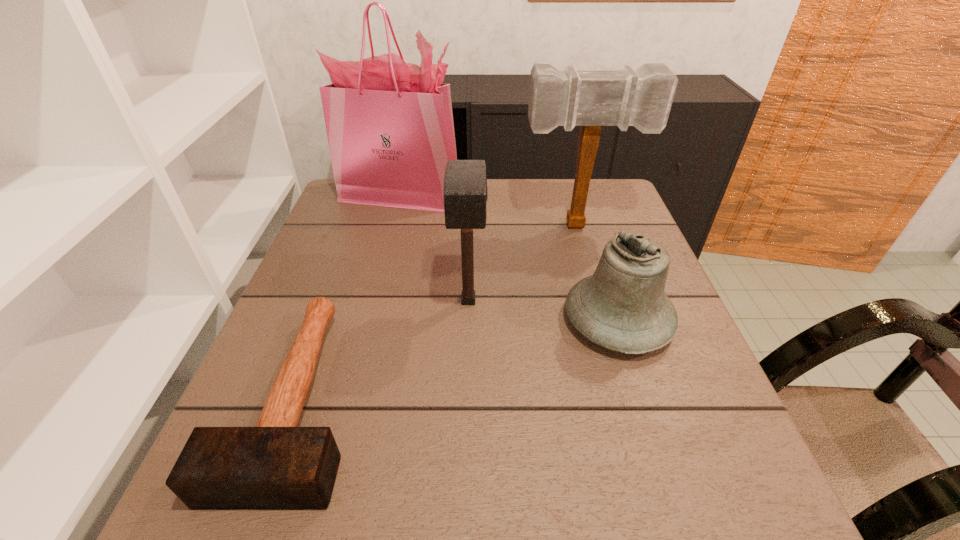
Select which mallet is the closest to the farthest mallet. Please provide its 2D coordinates. Your answer should be formatted as a tuple, i.e. [(x, y)], where the tuple contains the x and y coordinates of a point satisfying the conditions above.

[(465, 192)]

Point out which mallet is positioned as the nearest to the tallest mallet. Please provide its 2D coordinates. Your answer should be formatted as a tuple, i.e. [(x, y)], where the tuple contains the x and y coordinates of a point satisfying the conditions above.

[(465, 192)]

Where is `vacant space that satisfies the following two spatial constraints: 1. on the front side of the fourth shortest object; 2. on the right side of the farthest object`? vacant space that satisfies the following two spatial constraints: 1. on the front side of the fourth shortest object; 2. on the right side of the farthest object is located at coordinates (392, 226).

Find the location of a particular element. free space that satisfies the following two spatial constraints: 1. on the back side of the fourth shortest object; 2. on the left side of the third tallest object is located at coordinates (470, 226).